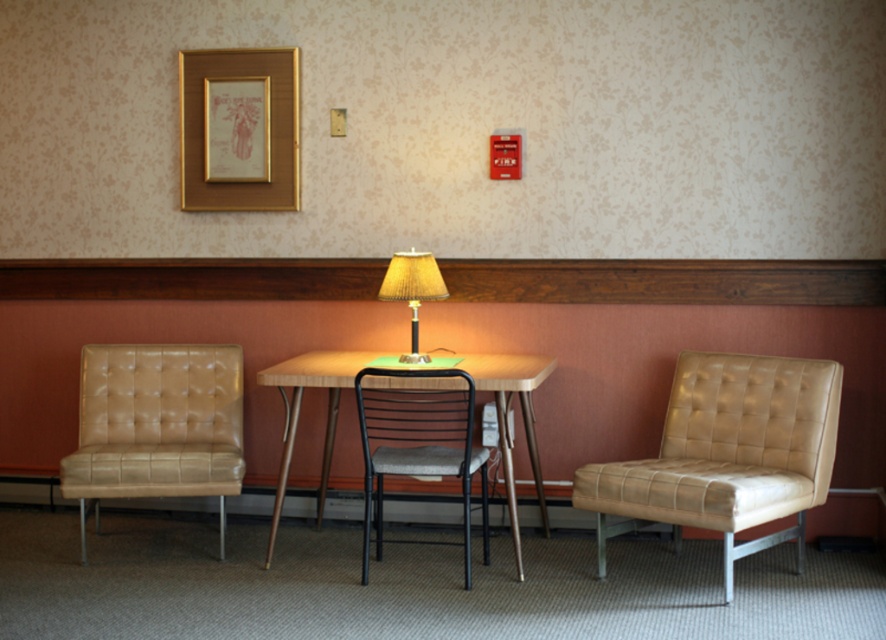
Question: Which object is positioned farthest from the matte beige lampshade at center?

Choices:
 (A) tan leather armchair at left
 (B) wooden table at center
 (C) matte leather armchair at right
 (D) gold metallic picture frame at upper center

Answer: (C)

Question: Among these objects, which one is nearest to the camera?

Choices:
 (A) matte leather armchair at right
 (B) wooden table at center

Answer: (A)

Question: Is black metal chair at center above wooden table at center?

Choices:
 (A) yes
 (B) no

Answer: (B)

Question: Based on their relative distances, which object is farther from the gold metallic picture frame at upper center?

Choices:
 (A) black metal chair at center
 (B) tan leather armchair at left
 (C) matte beige lampshade at center

Answer: (A)

Question: Is black metal chair at center further to camera compared to wooden table at center?

Choices:
 (A) no
 (B) yes

Answer: (A)

Question: Is black metal chair at center above wooden table at center?

Choices:
 (A) yes
 (B) no

Answer: (B)